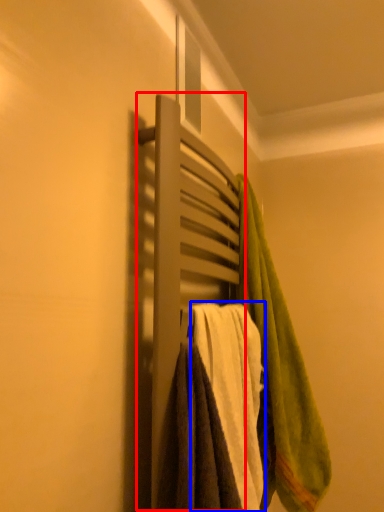
Question: Which point is closer to the camera, closet (highlighted by a red box) or towel (highlighted by a blue box)?

Choices:
 (A) closet
 (B) towel

Answer: (A)